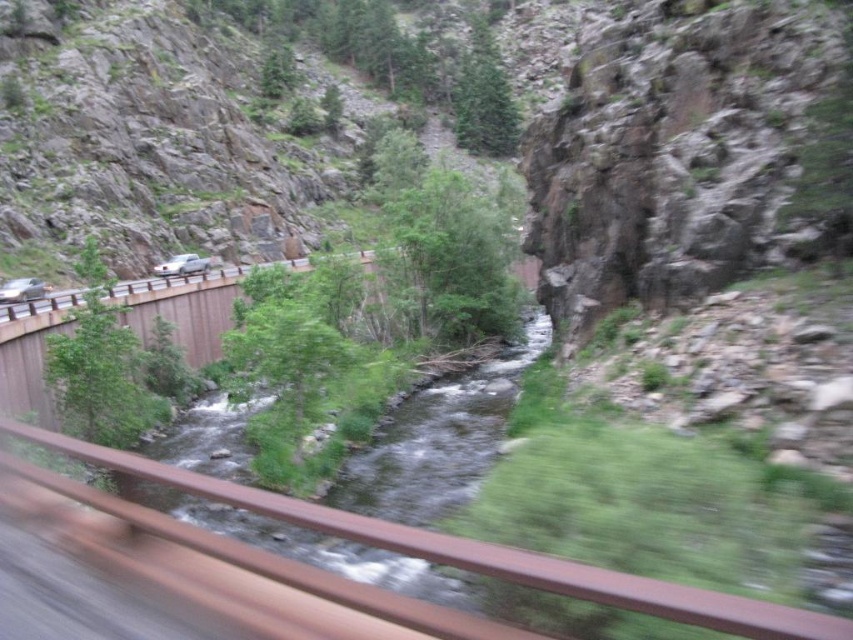
You are standing on the bridge and looking down at the river. There is a point marked at coordinates (436, 442). What is located at that point?

The point at coordinates (436, 442) indicates the green grassy river at center.

You are a hiker trying to cross the river using the train track. According to the scene description, can you safely step on the rusty metal train track at center to cross the green grassy river at center?

The green grassy river at center is positioned over the rusty metal train track at center, meaning the train track is submerged under the river. Therefore, you cannot safely step on the rusty metal train track at center to cross the green grassy river at center as it is underwater.